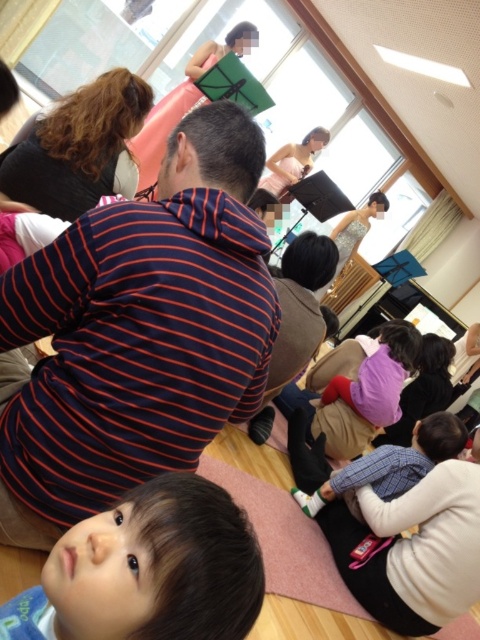
Question: From the image, what is the correct spatial relationship of brown hair at lower left in relation to purple fleece at center?

Choices:
 (A) left
 (B) right

Answer: (A)

Question: Estimate the real-world distances between objects in this image. Which object is closer to the brown hair at lower left?

Choices:
 (A) plaid fabric shirt at center
 (B) purple fleece at center

Answer: (A)

Question: Which of the following is the closest to the observer?

Choices:
 (A) purple fleece at center
 (B) brown hair at lower left
 (C) plaid fabric shirt at center

Answer: (B)

Question: Does striped fabric at center come behind brown hair at lower left?

Choices:
 (A) yes
 (B) no

Answer: (A)

Question: Which object is the farthest from the purple fleece at center?

Choices:
 (A) brown hair at lower left
 (B) striped fabric at center
 (C) plaid fabric shirt at center

Answer: (A)

Question: From the image, what is the correct spatial relationship of striped fabric at center in relation to brown hair at lower left?

Choices:
 (A) left
 (B) right

Answer: (A)